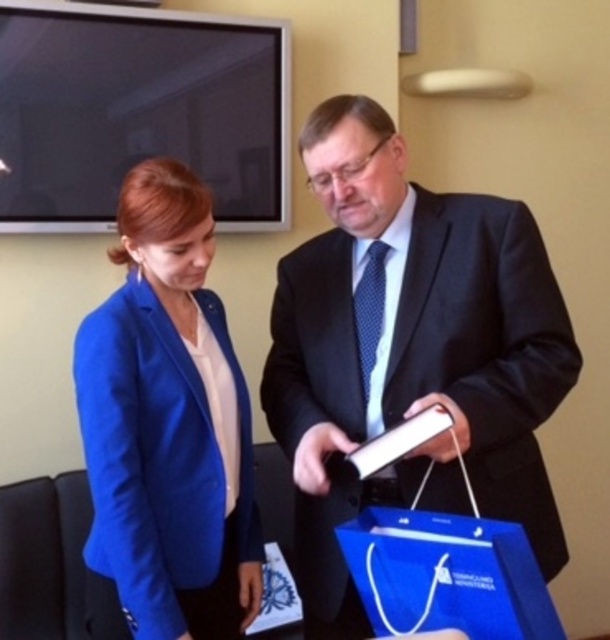
You are organizing a formal event and need to arrange seating based on the image. Since the matte black suit at center and the blue fabric jacket at left are both present, which one should be seated to the right of the other?

The matte black suit at center is positioned on the right side of blue fabric jacket at left, so the matte black suit at center should be seated to the right of the blue fabric jacket at left.

In the scene shown: You are standing in the conference room and want to place a small object exactly halfway between point (336, 154) and point (145, 385). Will the object be closer to the camera or further away from it compared to the midpoint between these two points?

The midpoint between point (336, 154) and point (145, 385) would be at the average of their coordinates. Since point (336, 154) is further to the camera than point (145, 385), the midpoint will be closer to the camera than the farther point but further than the nearer point. However, the question asks if the object placed at the halfway point is closer or further compared to the midpoint itself. Since the object is placed exactly at the midpoint, it is neither closer nor further. The answer should p

You are a security guard in the building and need to ensure that the distance between the two people is at least 12 inches for safety. Based on the scene, can you confirm if the distance between the matte black suit at center and the blue fabric jacket at left meets this requirement?

The distance between the matte black suit at center and the blue fabric jacket at left is 13.34 inches, which exceeds the required 12 inches, so the safety requirement is met.